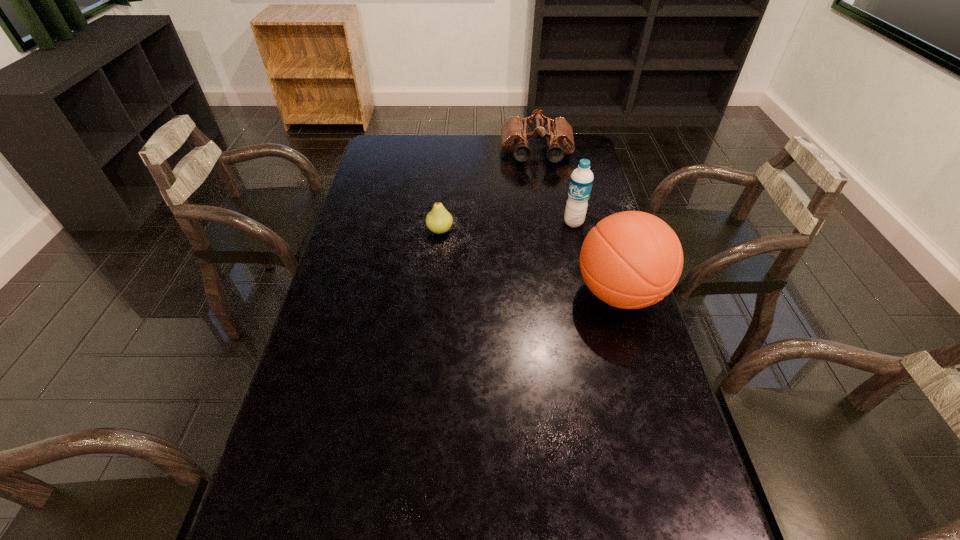
At what (x,y) coordinates should I click in order to perform the action: click on free space on the desktop that is between the leftmost object and the basketball and is positioned on the label of the water bottle. Please return your answer as a coordinate pair (x, y). Looking at the image, I should click on (512, 255).

Where is `free space on the desktop that is between the pear and the nearest object and is positioned through the eyepieces of the farthest object`? free space on the desktop that is between the pear and the nearest object and is positioned through the eyepieces of the farthest object is located at coordinates (546, 267).